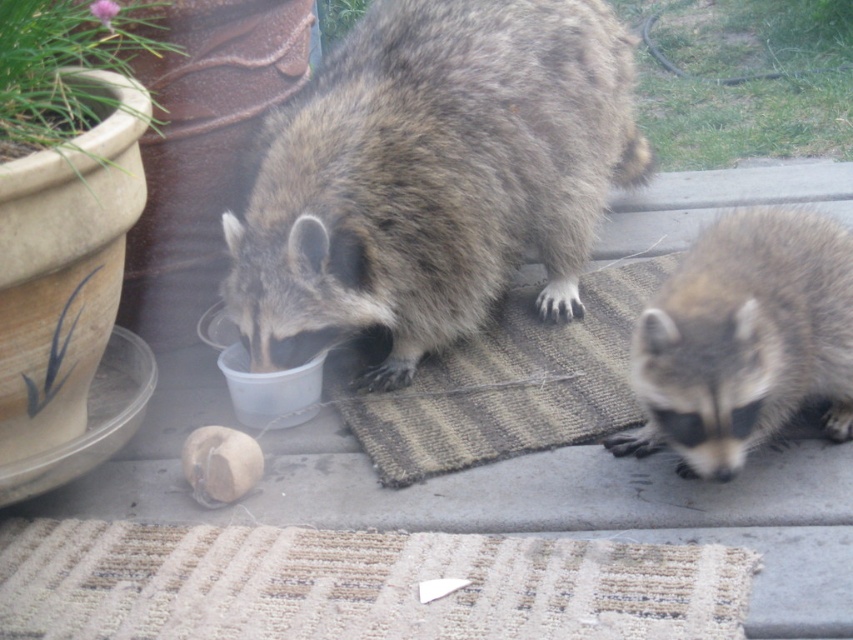
Question: Does fuzzy brown raccoon at center have a smaller size compared to fuzzy brown raccoon at lower right?

Choices:
 (A) no
 (B) yes

Answer: (A)

Question: Does fuzzy brown raccoon at center have a smaller size compared to fuzzy brown raccoon at lower right?

Choices:
 (A) yes
 (B) no

Answer: (B)

Question: Which of the following is the farthest from the observer?

Choices:
 (A) fuzzy brown raccoon at lower right
 (B) fuzzy brown raccoon at center

Answer: (B)

Question: Is fuzzy brown raccoon at center bigger than fuzzy brown raccoon at lower right?

Choices:
 (A) yes
 (B) no

Answer: (A)